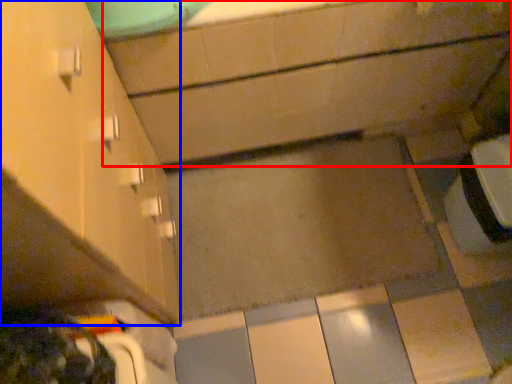
Question: Among these objects, which one is farthest to the camera, bath (highlighted by a red box) or cabinetry (highlighted by a blue box)?

Choices:
 (A) bath
 (B) cabinetry

Answer: (A)